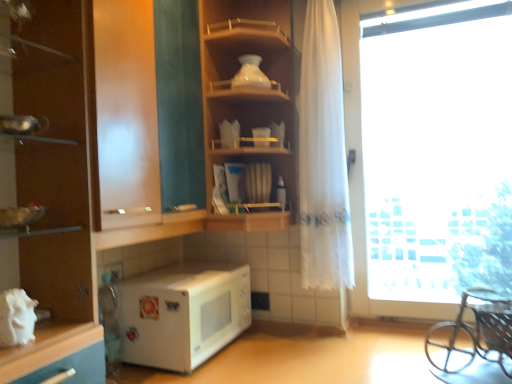
Question: Is transparent glass shelves at upper left, marked as the first shelf in a left-to-right arrangement, at the left side of matte brown cabinet at left?

Choices:
 (A) yes
 (B) no

Answer: (B)

Question: Does transparent glass shelves at upper left, the second shelf in the right-to-left sequence, lie behind matte brown cabinet at left?

Choices:
 (A) yes
 (B) no

Answer: (A)

Question: Is transparent glass shelves at upper left, marked as the first shelf in a left-to-right arrangement, bigger than matte brown cabinet at left?

Choices:
 (A) no
 (B) yes

Answer: (B)

Question: Can you confirm if transparent glass shelves at upper left, marked as the first shelf in a left-to-right arrangement, is taller than matte brown cabinet at left?

Choices:
 (A) yes
 (B) no

Answer: (B)

Question: From a real-world perspective, is transparent glass shelves at upper left, the second shelf in the right-to-left sequence, located higher than matte brown cabinet at left?

Choices:
 (A) no
 (B) yes

Answer: (B)

Question: Relative to transparent glass shelves at upper left, the second shelf in the right-to-left sequence, is transparent glass window at right in front or behind?

Choices:
 (A) behind
 (B) front

Answer: (A)

Question: Based on their sizes in the image, would you say transparent glass window at right is bigger or smaller than transparent glass shelves at upper left, marked as the first shelf in a left-to-right arrangement?

Choices:
 (A) small
 (B) big

Answer: (A)

Question: Would you say transparent glass window at right is to the left or to the right of transparent glass shelves at upper left, marked as the first shelf in a left-to-right arrangement, in the picture?

Choices:
 (A) left
 (B) right

Answer: (B)

Question: Choose the correct answer: Is transparent glass window at right inside transparent glass shelves at upper left, the second shelf in the right-to-left sequence, or outside it?

Choices:
 (A) inside
 (B) outside

Answer: (B)

Question: From the image's perspective, is matte brown cabinet at left positioned above or below wooden shelf at center, which ranks as the 2th shelf in left-to-right order?

Choices:
 (A) above
 (B) below

Answer: (B)

Question: From a real-world perspective, is matte brown cabinet at left positioned above or below wooden shelf at center, which ranks as the 2th shelf in left-to-right order?

Choices:
 (A) below
 (B) above

Answer: (A)

Question: Looking at their shapes, would you say matte brown cabinet at left is wider or thinner than wooden shelf at center, which appears as the first shelf when viewed from the right?

Choices:
 (A) thin
 (B) wide

Answer: (A)

Question: Visually, is matte brown cabinet at left positioned to the left or to the right of wooden shelf at center, which ranks as the 2th shelf in left-to-right order?

Choices:
 (A) left
 (B) right

Answer: (A)

Question: From the image's perspective, relative to matte brown cabinet at left, is transparent glass window at right above or below?

Choices:
 (A) below
 (B) above

Answer: (B)

Question: Considering the positions of transparent glass window at right and matte brown cabinet at left in the image, is transparent glass window at right wider or thinner than matte brown cabinet at left?

Choices:
 (A) thin
 (B) wide

Answer: (A)